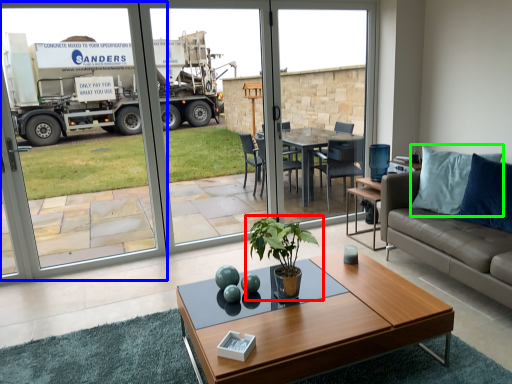
Question: Which object is the closest to the houseplant (highlighted by a red box)? Choose among these: screen door (highlighted by a blue box) or pillow (highlighted by a green box).

Choices:
 (A) screen door
 (B) pillow

Answer: (B)